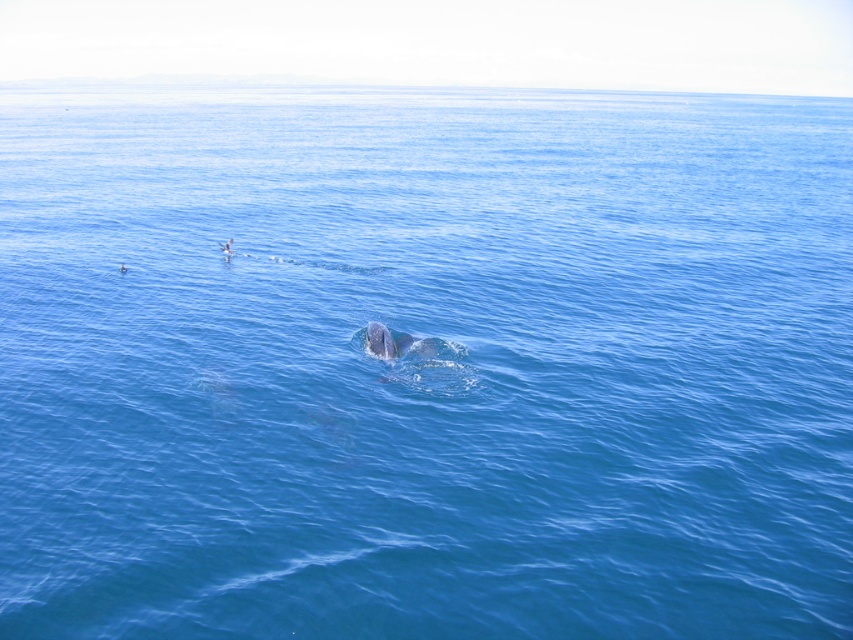
Does gray matte whale at center have a larger size compared to smooth skin person at upper left?

Indeed, gray matte whale at center has a larger size compared to smooth skin person at upper left.

Between gray matte whale at center and smooth skin person at upper left, which one appears on the left side from the viewer's perspective?

smooth skin person at upper left

Is point (393, 348) more distant than point (225, 243)?

That is False.

Image resolution: width=853 pixels, height=640 pixels. I want to click on gray matte whale at center, so click(x=386, y=340).